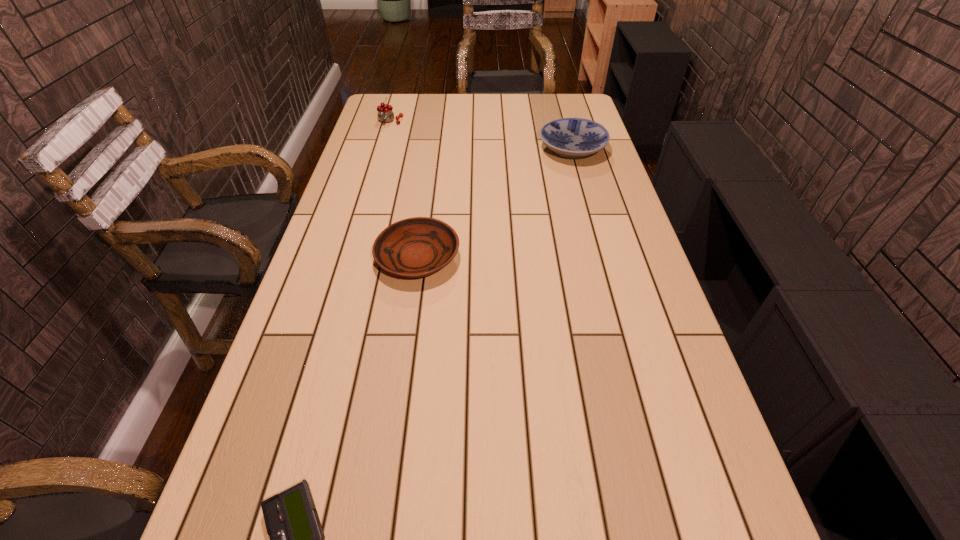
This screenshot has height=540, width=960. Identify the location of object that is at the left edge. (385, 114).

Where is `object situated at the right edge`? The width and height of the screenshot is (960, 540). object situated at the right edge is located at coordinates tap(572, 138).

Where is `object located at the far left corner`? object located at the far left corner is located at coordinates (385, 114).

Where is `blank space at the far edge`? blank space at the far edge is located at coordinates (441, 119).

Identify the location of blank space at the left edge of the desktop. (348, 259).

Where is `vacant space at the right edge of the desktop`? vacant space at the right edge of the desktop is located at coordinates (603, 193).

Locate an element on the screen. Image resolution: width=960 pixels, height=540 pixels. free point at the far right corner is located at coordinates (562, 106).

This screenshot has width=960, height=540. I want to click on free area in between the nearer plate and the farther plate, so click(495, 204).

Find the location of `free point between the cherry and the second farthest object`. free point between the cherry and the second farthest object is located at coordinates (x=481, y=136).

Where is `the second closest object to the second nearest object`? This screenshot has width=960, height=540. the second closest object to the second nearest object is located at coordinates (297, 539).